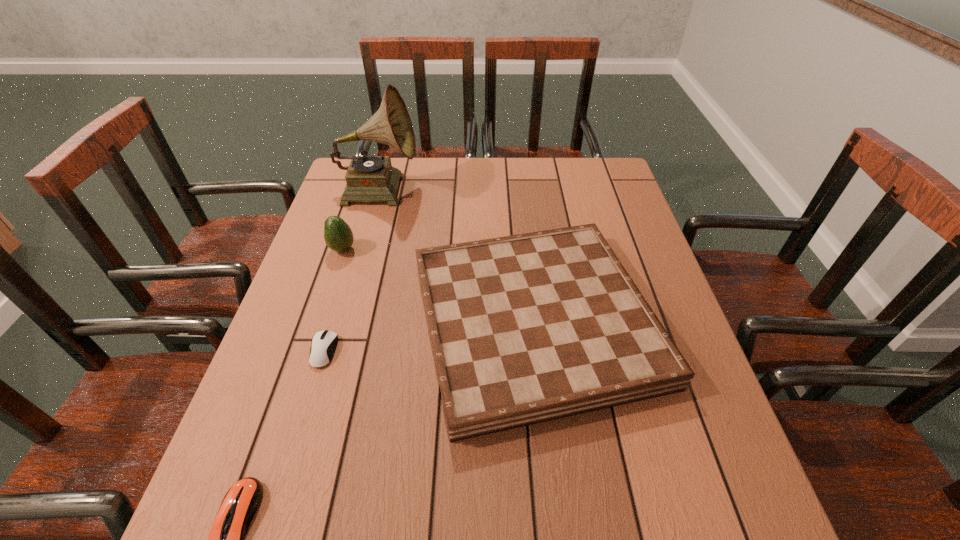
Locate an element on the screen. This screenshot has width=960, height=540. the tallest object is located at coordinates (369, 178).

Locate an element on the screen. Image resolution: width=960 pixels, height=540 pixels. the farthest object is located at coordinates (369, 178).

In order to click on avocado in this screenshot , I will do click(338, 236).

Locate an element on the screen. The width and height of the screenshot is (960, 540). gameboard is located at coordinates (528, 328).

This screenshot has width=960, height=540. Identify the location of the third shortest object. (528, 328).

Locate an element on the screen. the farther computer mouse is located at coordinates (324, 343).

Image resolution: width=960 pixels, height=540 pixels. I want to click on free space located 0.070m from the horn of the tallest object, so click(442, 188).

Where is `vacant point located 0.070m on the front of the avocado`? This screenshot has width=960, height=540. vacant point located 0.070m on the front of the avocado is located at coordinates (333, 277).

You are a GUI agent. You are given a task and a screenshot of the screen. Output one action in this format:
    pyautogui.click(x=<x>, y=<y>)
    Task: Click on the free space located 0.100m on the left of the third tallest object
    Image resolution: width=960 pixels, height=540 pixels.
    Given the screenshot: What is the action you would take?
    pyautogui.click(x=367, y=321)

Find the location of a particular element. vacant space located 0.130m on the front of the farther computer mouse is located at coordinates (300, 427).